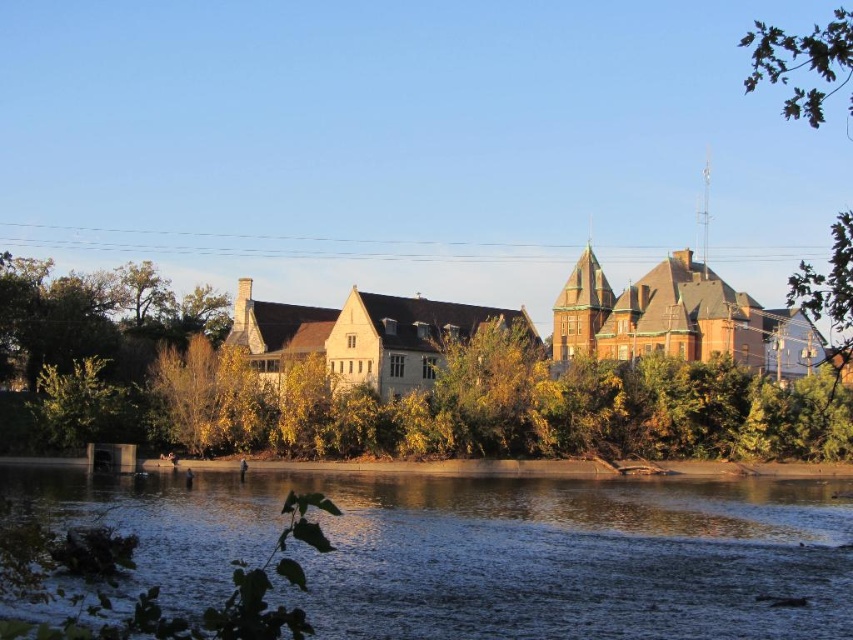
Does dark blue water at lower center appear under green leafy tree at center?

Yes, dark blue water at lower center is below green leafy tree at center.

Between point (245, 500) and point (358, 316), which one is positioned in front?

Point (245, 500)

The width and height of the screenshot is (853, 640). In order to click on dark blue water at lower center in this screenshot , I will do `click(495, 550)`.